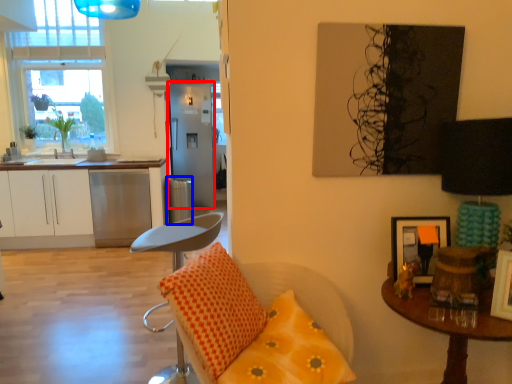
Question: Which object is further to the camera taking this photo, fridge (highlighted by a red box) or trash bin/can (highlighted by a blue box)?

Choices:
 (A) fridge
 (B) trash bin/can

Answer: (A)